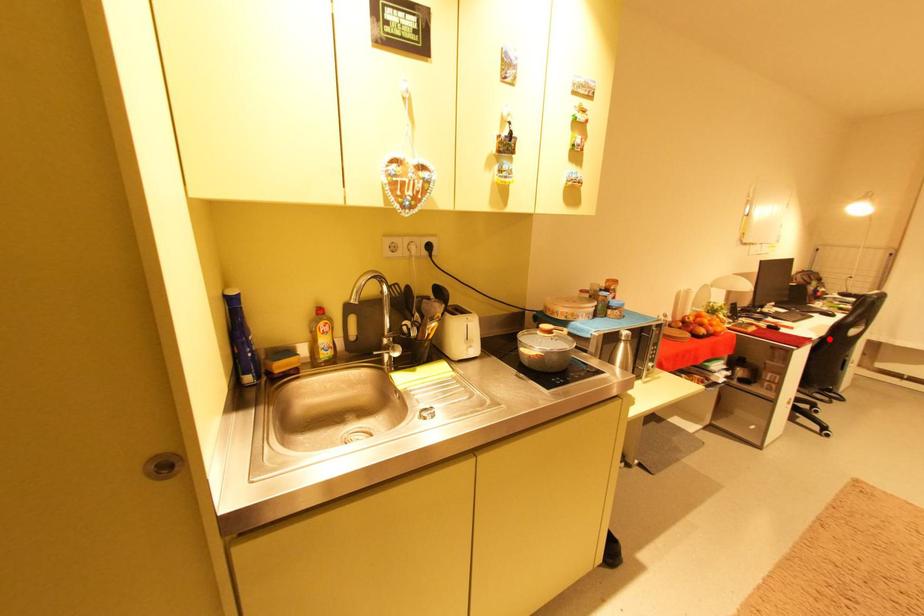
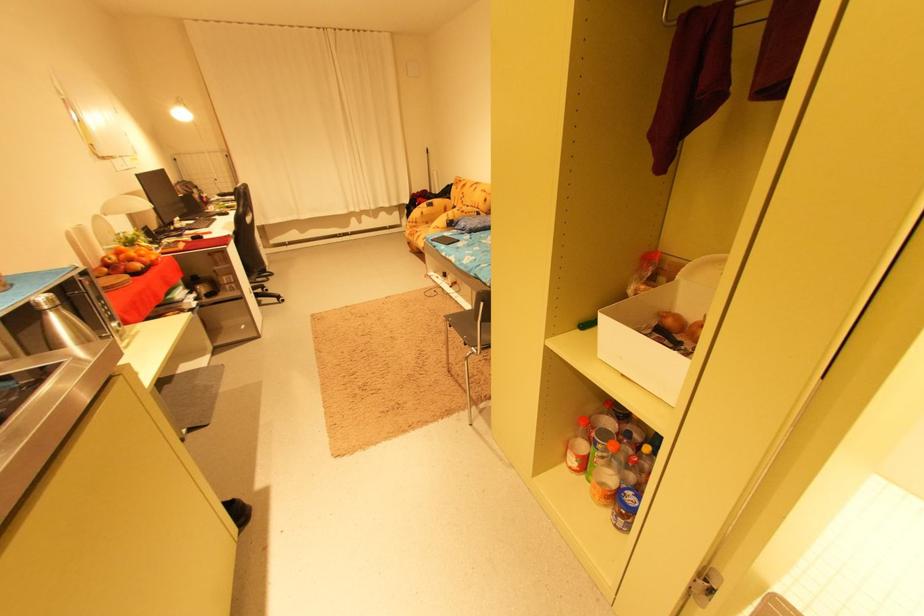
Question: A red point is marked in image1. In image2, is the corresponding 3D point closer to the camera or farther? Reply with the corresponding letter.

Choices:
 (A) The corresponding 3D point is closer.
 (B) The corresponding 3D point is farther.

Answer: (A)